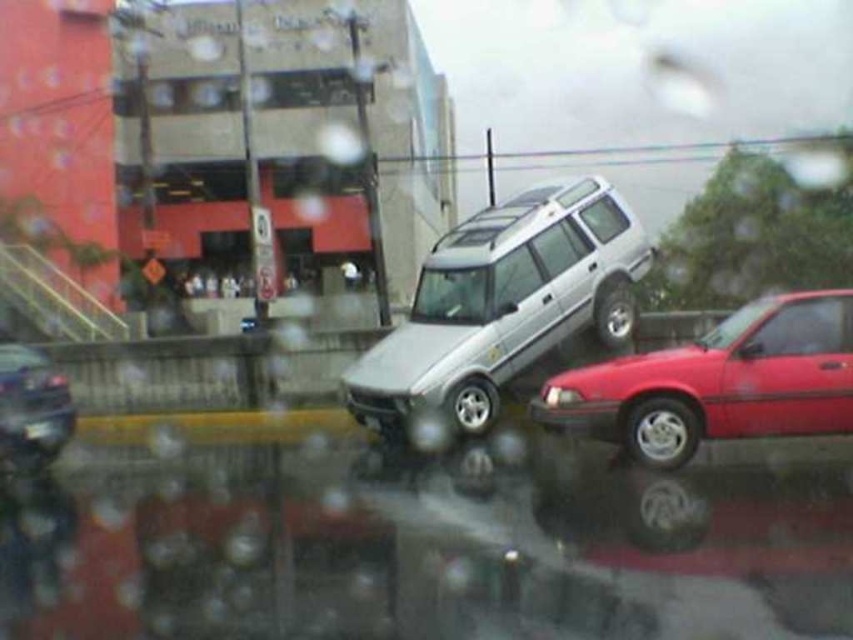
Can you confirm if silver metallic suv at center is smaller than shiny red sedan at right?

No, silver metallic suv at center is not smaller than shiny red sedan at right.

Which is in front, point (483, 417) or point (735, 364)?

Positioned in front is point (735, 364).

You are a GUI agent. You are given a task and a screenshot of the screen. Output one action in this format:
    pyautogui.click(x=<x>, y=<y>)
    Task: Click on the silver metallic suv at center
    Image resolution: width=853 pixels, height=640 pixels.
    Given the screenshot: What is the action you would take?
    [503, 305]

Between point (491, 209) and point (47, 436), which one is positioned behind?

The point (491, 209) is behind.

Between silver metallic suv at center and black plastic license plate at lower left, which one is positioned lower?

black plastic license plate at lower left is lower down.

Identify the location of silver metallic suv at center. (503, 305).

Image resolution: width=853 pixels, height=640 pixels. I want to click on silver metallic suv at center, so click(503, 305).

Can you confirm if shiny red sedan at right is positioned below black plastic license plate at lower left?

Incorrect, shiny red sedan at right is not positioned below black plastic license plate at lower left.

Does shiny red sedan at right have a greater width compared to black plastic license plate at lower left?

Yes, shiny red sedan at right is wider than black plastic license plate at lower left.

Is point (779, 419) less distant than point (42, 436)?

That is True.

Identify the location of shiny red sedan at right. This screenshot has width=853, height=640. (718, 381).